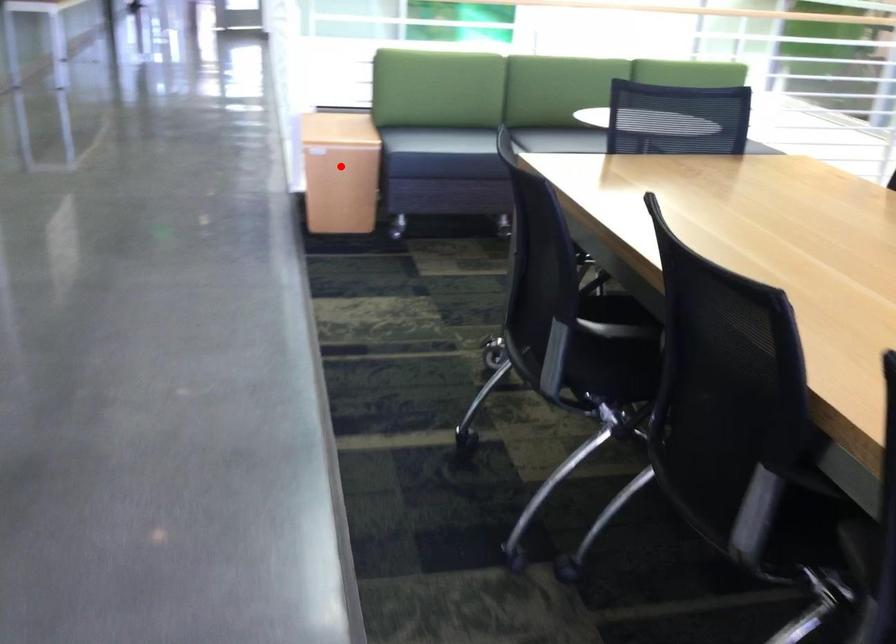
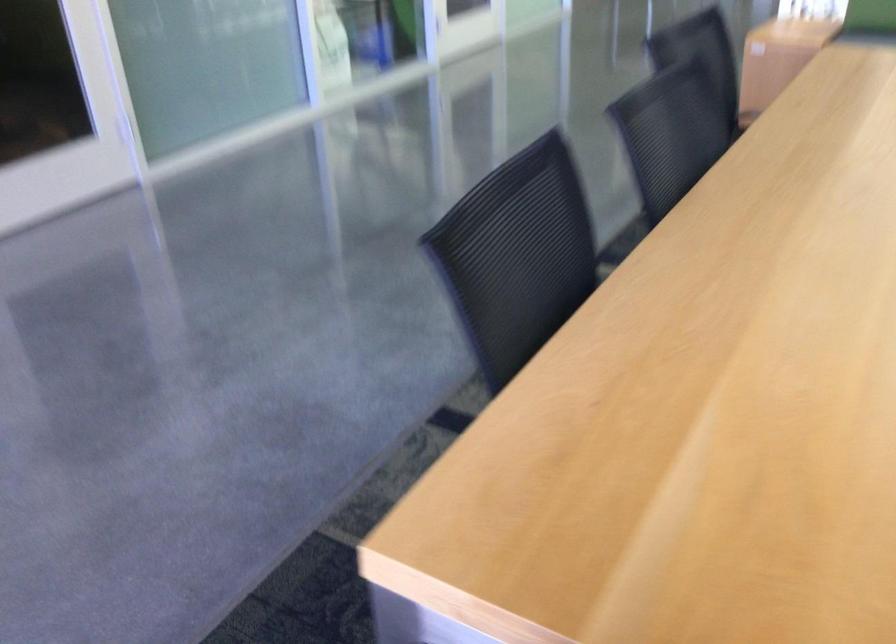
In the second image, find the point that corresponds to the highlighted location in the first image.

(778, 58)